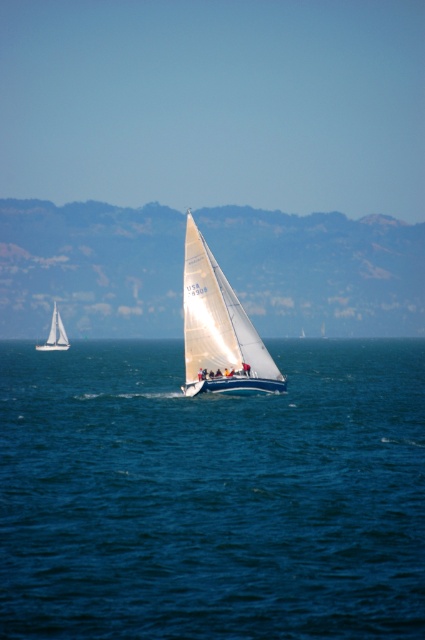
Does blue water at center have a larger size compared to white matte sailboat at center?

Yes, blue water at center is bigger than white matte sailboat at center.

Between blue water at center and white matte sailboat at center, which one has less height?

Answer: With less height is blue water at center.

Find the location of `blue water at center`. blue water at center is located at coordinates point(212,493).

I want to click on blue water at center, so click(x=212, y=493).

Who is shorter, white matte sailboat at center or white matte sailboat at left?

white matte sailboat at center is shorter.

Can you confirm if white matte sailboat at center is positioned above white matte sailboat at left?

Indeed, white matte sailboat at center is positioned over white matte sailboat at left.

Which is in front, point (193, 323) or point (62, 339)?

Positioned in front is point (193, 323).

This screenshot has height=640, width=425. Find the location of `white matte sailboat at center`. white matte sailboat at center is located at coordinates (220, 330).

Can you confirm if white sailboat at upper center is wider than white matte sailboat at center?

Indeed, white sailboat at upper center has a greater width compared to white matte sailboat at center.

Who is taller, white sailboat at upper center or white matte sailboat at center?

white sailboat at upper center

At what (x,y) coordinates should I click in order to perform the action: click on white sailboat at upper center. Please return your answer as a coordinate pair (x, y). Image resolution: width=425 pixels, height=640 pixels. Looking at the image, I should click on (320, 269).

Locate an element on the screen. The width and height of the screenshot is (425, 640). white sailboat at upper center is located at coordinates (320, 269).